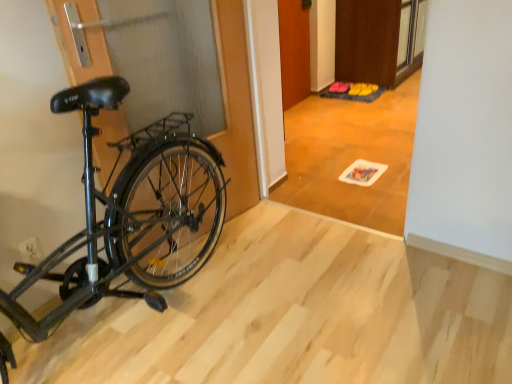
The image size is (512, 384). I want to click on free space above yellow fabric walking shoe at center, the 2th walking shoe viewed from the left (from a real-world perspective), so click(371, 86).